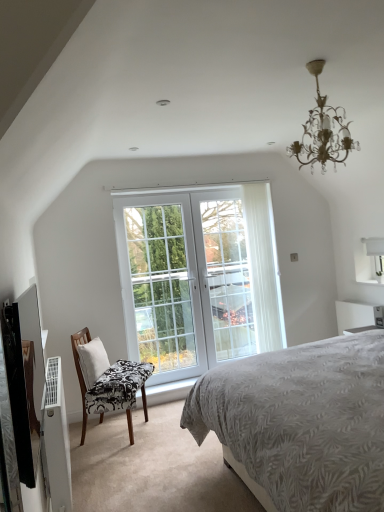
What do you see at coordinates (263, 267) in the screenshot? I see `white sheer curtain at center` at bounding box center [263, 267].

Measure the distance between white glass screen door at center and camera.

white glass screen door at center is 4.53 meters from camera.

Describe the element at coordinates (107, 381) in the screenshot. Image resolution: width=384 pixels, height=512 pixels. I see `black and white patterned fabric chair at lower left` at that location.

The height and width of the screenshot is (512, 384). Describe the element at coordinates (92, 361) in the screenshot. I see `white fabric pillow at left` at that location.

The height and width of the screenshot is (512, 384). In order to click on gold metallic chandelier at upper center in this screenshot , I will do `click(323, 131)`.

You are a GUI agent. You are given a task and a screenshot of the screen. Output one action in this format:
    pyautogui.click(x=<x>, y=<y>)
    Task: Click on the white plastic air conditioner at lower left
    The height and width of the screenshot is (512, 384).
    Given the screenshot: What is the action you would take?
    pyautogui.click(x=57, y=438)

Does gold metallic chandelier at upper center appear on the right side of black and white patterned fabric chair at lower left?

Correct, you'll find gold metallic chandelier at upper center to the right of black and white patterned fabric chair at lower left.

Between gold metallic chandelier at upper center and black and white patterned fabric chair at lower left, which one has larger width?

Wider between the two is black and white patterned fabric chair at lower left.

Considering the positions of point (308, 124) and point (103, 358), is point (308, 124) closer or farther from the camera than point (103, 358)?

Point (308, 124) appears to be closer to the viewer than point (103, 358).

Which is in front, gold metallic chandelier at upper center or black and white patterned fabric chair at lower left?

Positioned in front is gold metallic chandelier at upper center.

Is white sheer curtain at center in contact with gold metallic chandelier at upper center?

There is a gap between white sheer curtain at center and gold metallic chandelier at upper center.

Could gold metallic chandelier at upper center be considered to be inside white sheer curtain at center?

No, gold metallic chandelier at upper center is not a part of white sheer curtain at center.

Does point (259, 291) appear closer or farther from the camera than point (309, 130)?

Point (259, 291) is farther from the camera than point (309, 130).

From a real-world perspective, between white sheer curtain at center and gold metallic chandelier at upper center, who is vertically higher?

gold metallic chandelier at upper center.

From the image's perspective, between white fabric pillow at left and white plastic air conditioner at lower left, who is located below?

white plastic air conditioner at lower left appears lower in the image.

Does white fabric pillow at left come behind white plastic air conditioner at lower left?

That is True.

Could you tell me if white fabric pillow at left is turned towards white plastic air conditioner at lower left?

No, white fabric pillow at left does not turn towards white plastic air conditioner at lower left.

Would you say white fabric pillow at left is inside or outside white plastic air conditioner at lower left?

white fabric pillow at left is located beyond the bounds of white plastic air conditioner at lower left.

Who is shorter, gold metallic chandelier at upper center or white glossy vanity at upper right?

white glossy vanity at upper right.

Can you confirm if gold metallic chandelier at upper center is positioned to the left of white glossy vanity at upper right?

Yes, gold metallic chandelier at upper center is to the left of white glossy vanity at upper right.

Is point (309, 140) behind point (372, 306)?

No, it is not.

From a real-world perspective, is gold metallic chandelier at upper center beneath white glossy vanity at upper right?

Incorrect, from a real-world perspective, gold metallic chandelier at upper center is higher than white glossy vanity at upper right.

In the scene shown: Is white glass door at center, marked as the second window in a right-to-left arrangement, in contact with white glossy vanity at upper right?

There is a gap between white glass door at center, marked as the second window in a right-to-left arrangement, and white glossy vanity at upper right.

Considering their positions, is white glass door at center, marked as the second window in a right-to-left arrangement, located in front of or behind white glossy vanity at upper right?

Visually, white glass door at center, marked as the second window in a right-to-left arrangement, is located behind white glossy vanity at upper right.

Consider the image. Is white glass door at center, placed as the first window when sorted from left to right, smaller than white glossy vanity at upper right?

No, white glass door at center, placed as the first window when sorted from left to right, is not smaller than white glossy vanity at upper right.

From a real-world perspective, which object stands above the other?

white glass door at center, marked as the second window in a right-to-left arrangement, is physically above.

Consider the image. From a real-world perspective, is white plastic air conditioner at lower left positioned over white glass door at center, which is the first window in right-to-left order, based on gravity?

No, from a real-world perspective, white plastic air conditioner at lower left is not above white glass door at center, which is the first window in right-to-left order.

What's the angular difference between white plastic air conditioner at lower left and white glass door at center, which is the first window in right-to-left order,'s facing directions?

white plastic air conditioner at lower left and white glass door at center, which is the first window in right-to-left order, are facing 90.1 degrees away from each other.

Who is taller, white plastic air conditioner at lower left or white glass door at center, which is the first window in right-to-left order?

white glass door at center, which is the first window in right-to-left order, is taller.

Is white plastic air conditioner at lower left located outside white glass door at center, which appears as the 2th window when viewed from the left?

Yes, white plastic air conditioner at lower left is not within white glass door at center, which appears as the 2th window when viewed from the left.

Looking at this image, from a real-world perspective, is white plastic air conditioner at lower left positioned over white glass door at center, marked as the second window in a right-to-left arrangement, based on gravity?

No, from a real-world perspective, white plastic air conditioner at lower left is not over white glass door at center, marked as the second window in a right-to-left arrangement

Which window is the 2nd one when counting from the back of the white plastic air conditioner at lower left? Please provide its 2D coordinates.

[(160, 285)]

From the image's perspective, which is above, white plastic air conditioner at lower left or white glass door at center, marked as the second window in a right-to-left arrangement?

white glass door at center, marked as the second window in a right-to-left arrangement, appears higher in the image.

Is white glass door at center, placed as the first window when sorted from left to right, located within white plastic air conditioner at lower left?

Definitely not — white glass door at center, placed as the first window when sorted from left to right, is not inside white plastic air conditioner at lower left.

Locate an element on the screen. Image resolution: width=384 pixels, height=512 pixels. light fixture on the right of black and white patterned fabric chair at lower left is located at coordinates (323, 131).

What are the coordinates of `curtain behind the gold metallic chandelier at upper center` in the screenshot? It's located at (263, 267).

When comparing their distances from white glass screen door at center, does white sheer curtain at center or white glass door at center, which is the first window in right-to-left order, seem further?

white sheer curtain at center is positioned further to the anchor white glass screen door at center.

Based on their spatial positions, is white sheer curtain at center or white plastic air conditioner at lower left closer to white glass door at center, marked as the second window in a right-to-left arrangement?

Among the two, white sheer curtain at center is located nearer to white glass door at center, marked as the second window in a right-to-left arrangement.

Which object lies further to the anchor point white glass door at center, which appears as the 2th window when viewed from the left, white sheer curtain at center or white plastic air conditioner at lower left?

Among the two, white plastic air conditioner at lower left is located further to white glass door at center, which appears as the 2th window when viewed from the left.

Consider the image. Considering their positions, is white fabric pillow at left positioned closer to white glass screen door at center than black and white patterned fabric chair at lower left?

Based on the image, black and white patterned fabric chair at lower left appears to be nearer to white glass screen door at center.

Based on the photo, estimate the real-world distances between objects in this image. Which object is further from white glass door at center, marked as the second window in a right-to-left arrangement, white glass screen door at center or black and white patterned fabric chair at lower left?

black and white patterned fabric chair at lower left lies further to white glass door at center, marked as the second window in a right-to-left arrangement, than the other object.

Based on the photo, when comparing their distances from white glass door at center, marked as the second window in a right-to-left arrangement, does white plastic air conditioner at lower left or white glass screen door at center seem further?

white plastic air conditioner at lower left is further to white glass door at center, marked as the second window in a right-to-left arrangement.

Estimate the real-world distances between objects in this image. Which object is further from white sheer curtain at center, white glass door at center, placed as the first window when sorted from left to right, or white plastic air conditioner at lower left?

Based on the image, white plastic air conditioner at lower left appears to be further to white sheer curtain at center.

Based on their spatial positions, is white glass screen door at center or white glass door at center, marked as the second window in a right-to-left arrangement, closer to white plastic air conditioner at lower left?

Among the two, white glass door at center, marked as the second window in a right-to-left arrangement, is located nearer to white plastic air conditioner at lower left.

Locate an element on the screen. The image size is (384, 512). window between gold metallic chandelier at upper center and white glass door at center, marked as the second window in a right-to-left arrangement, along the z-axis is located at coordinates click(x=198, y=278).

Where is `curtain between white plastic air conditioner at lower left and white glossy vanity at upper right from left to right`? This screenshot has height=512, width=384. curtain between white plastic air conditioner at lower left and white glossy vanity at upper right from left to right is located at coordinates 263,267.

The width and height of the screenshot is (384, 512). In order to click on chair between white fabric pillow at left and white sheer curtain at center from left to right in this screenshot , I will do (x=107, y=381).

This screenshot has width=384, height=512. I want to click on pillow between white plastic air conditioner at lower left and white glass screen door at center in the front-back direction, so click(x=92, y=361).